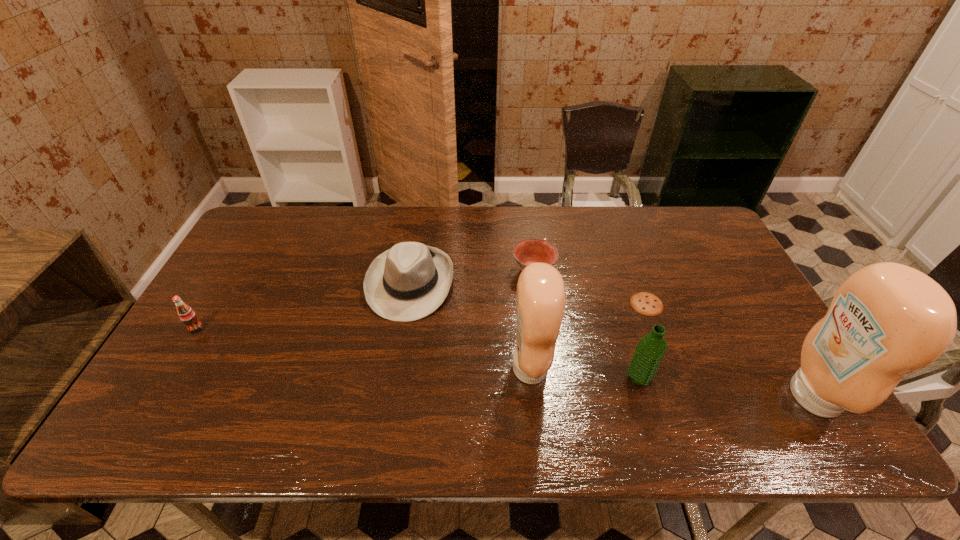
In the current image, all condiments are evenly spaced. To maintain this equal spacing, where should an additional condiment be placed on the left? Please point out a free spot. Please provide its 2D coordinates. Your answer should be formatted as a tuple, i.e. [(x, y)], where the tuple contains the x and y coordinates of a point satisfying the conditions above.

[(276, 343)]